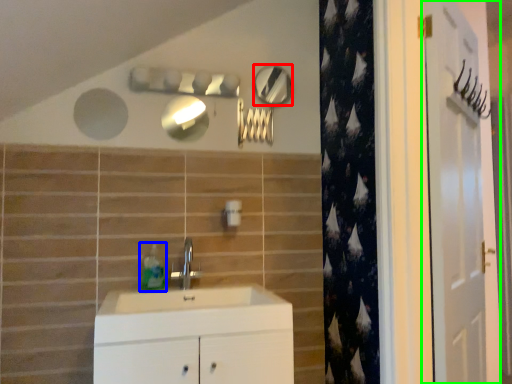
Question: Which object is positioned closest to mirror (highlighted by a red box)? Select from soap dispenser (highlighted by a blue box) and door (highlighted by a green box).

Choices:
 (A) soap dispenser
 (B) door

Answer: (A)